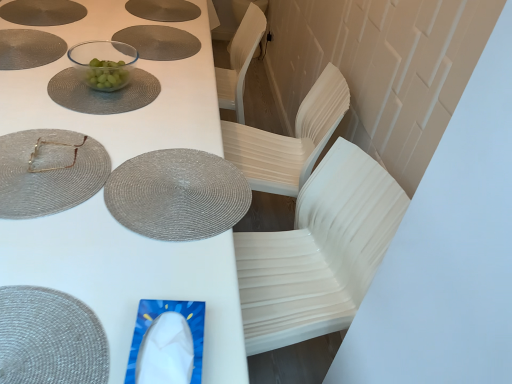
The image size is (512, 384). In order to click on free area in between silver textured placemat at center, marked as the third tableware in a back-to-front arrangement, and transparent glass bowl at upper center, the 1th glass plate positioned from the top in this screenshot , I will do `click(150, 119)`.